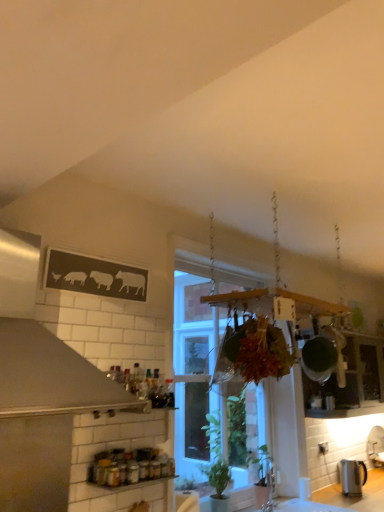
Question: Should I look upward or downward to see clear glass window at center?

Choices:
 (A) down
 (B) up

Answer: (A)

Question: Does metallic glass jars at lower center have a greater height compared to satin silver exhaust hood at upper left?

Choices:
 (A) yes
 (B) no

Answer: (B)

Question: Is metallic glass jars at lower center thinner than satin silver exhaust hood at upper left?

Choices:
 (A) yes
 (B) no

Answer: (A)

Question: Is metallic glass jars at lower center smaller than satin silver exhaust hood at upper left?

Choices:
 (A) yes
 (B) no

Answer: (A)

Question: Is metallic glass jars at lower center to the left of satin silver exhaust hood at upper left from the viewer's perspective?

Choices:
 (A) yes
 (B) no

Answer: (B)

Question: Does metallic glass jars at lower center come behind satin silver exhaust hood at upper left?

Choices:
 (A) no
 (B) yes

Answer: (B)

Question: Can you confirm if metallic glass jars at lower center is wider than satin silver exhaust hood at upper left?

Choices:
 (A) no
 (B) yes

Answer: (A)

Question: Does metallic glass jars at lower center lie in front of clear glass window at center?

Choices:
 (A) yes
 (B) no

Answer: (A)

Question: Is metallic glass jars at lower center wider than clear glass window at center?

Choices:
 (A) yes
 (B) no

Answer: (B)

Question: Is metallic glass jars at lower center far from clear glass window at center?

Choices:
 (A) yes
 (B) no

Answer: (A)

Question: Can you confirm if metallic glass jars at lower center is thinner than clear glass window at center?

Choices:
 (A) yes
 (B) no

Answer: (A)

Question: From a real-world perspective, is metallic glass jars at lower center physically above clear glass window at center?

Choices:
 (A) no
 (B) yes

Answer: (A)

Question: Is metallic glass jars at lower center positioned beyond the bounds of clear glass window at center?

Choices:
 (A) no
 (B) yes

Answer: (B)

Question: Is clear glass window at center thinner than metallic glass jars at lower center?

Choices:
 (A) no
 (B) yes

Answer: (A)